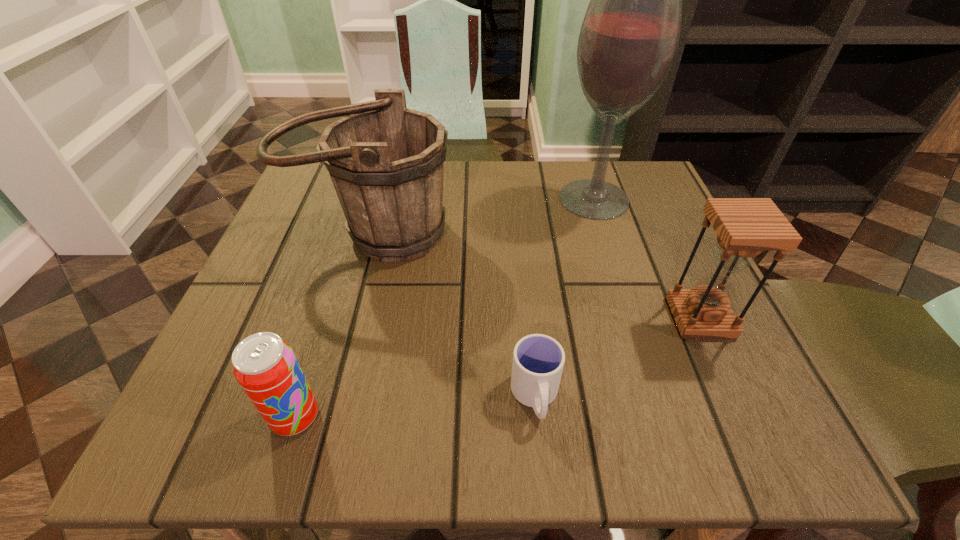
Where is `object situated at the near left corner`? This screenshot has height=540, width=960. object situated at the near left corner is located at coordinates (265, 366).

At what (x,y) coordinates should I click in order to perform the action: click on object at the far right corner. Please return your answer as a coordinate pair (x, y). The height and width of the screenshot is (540, 960). Looking at the image, I should click on pyautogui.click(x=629, y=37).

This screenshot has width=960, height=540. Find the location of `free space at the far edge of the desktop`. free space at the far edge of the desktop is located at coordinates (555, 204).

In the image, there is a desktop. At what (x,y) coordinates should I click in order to perform the action: click on free region at the near edge. Please return your answer as a coordinate pair (x, y). The height and width of the screenshot is (540, 960). Looking at the image, I should click on (601, 422).

Image resolution: width=960 pixels, height=540 pixels. Identify the location of free space at the left edge of the desktop. (317, 318).

Where is `free space at the right edge`? The width and height of the screenshot is (960, 540). free space at the right edge is located at coordinates (633, 273).

The image size is (960, 540). I want to click on vacant space at the far left corner, so click(x=329, y=177).

Identify the location of vacant space at the near left corner of the desktop. (190, 445).

This screenshot has width=960, height=540. In order to click on vacant space at the far right corner in this screenshot , I will do `click(656, 190)`.

At what (x,y) coordinates should I click in order to perform the action: click on vacant area between the soda can and the cup. Please return your answer as a coordinate pair (x, y). Looking at the image, I should click on (416, 407).